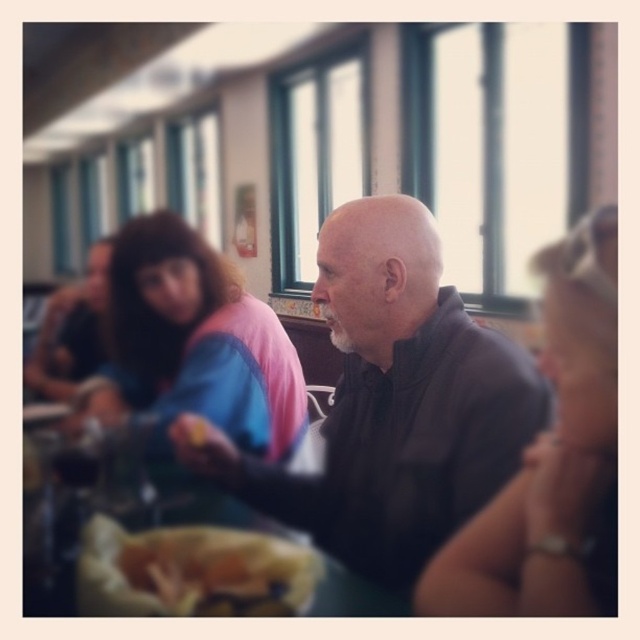
Question: Which object appears closest to the camera in this image?

Choices:
 (A) matte black jacket at upper left
 (B) pink fabric jacket at upper left
 (C) matte black shirt at center

Answer: (C)

Question: Which of the following is the farthest from the observer?

Choices:
 (A) (113, 276)
 (B) (605, 541)
 (C) (512, 396)

Answer: (A)

Question: Which object appears farthest from the camera in this image?

Choices:
 (A) dark brown leather jacket at center
 (B) matte black jacket at upper left
 (C) golden crispy bread at center
 (D) pink fabric jacket at upper left

Answer: (B)

Question: Is pink fabric jacket at upper left further to the viewer compared to golden crispy bread at center?

Choices:
 (A) no
 (B) yes

Answer: (B)

Question: Is dark brown leather jacket at center further to camera compared to brown wood table at center?

Choices:
 (A) no
 (B) yes

Answer: (B)

Question: Is pink fabric jacket at upper left to the left of matte black jacket at upper left from the viewer's perspective?

Choices:
 (A) yes
 (B) no

Answer: (B)